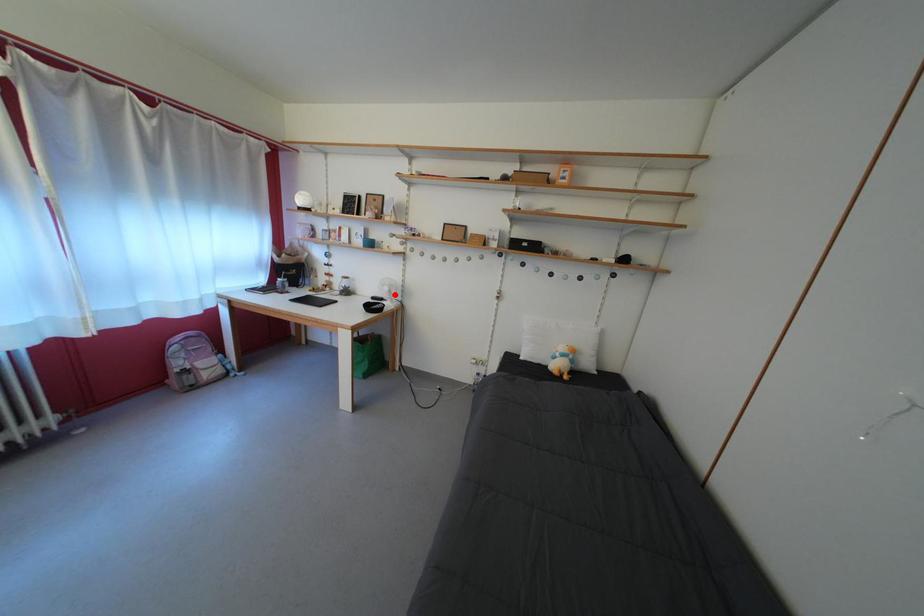
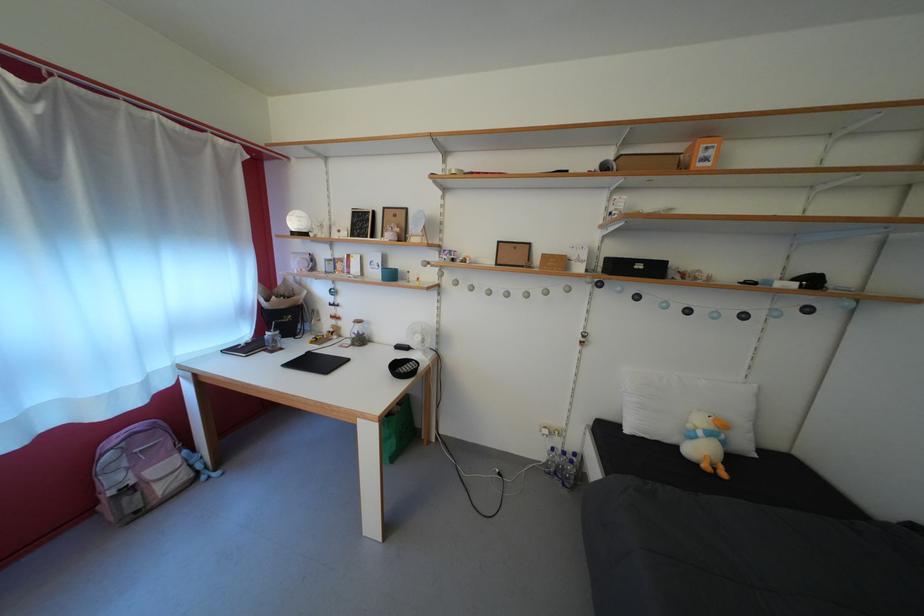
Where in the second image is the point corresponding to the highlighted location from the first image?

(427, 344)